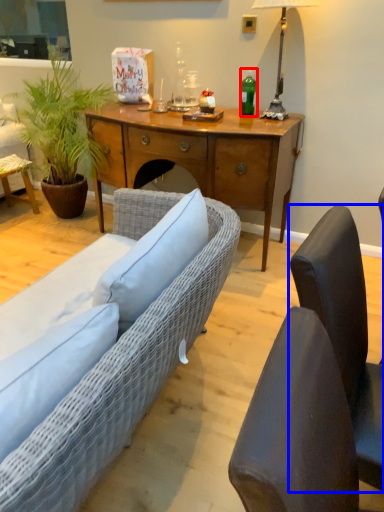
Question: Which point is closer to the camera, bottle (highlighted by a red box) or chair (highlighted by a blue box)?

Choices:
 (A) bottle
 (B) chair

Answer: (B)